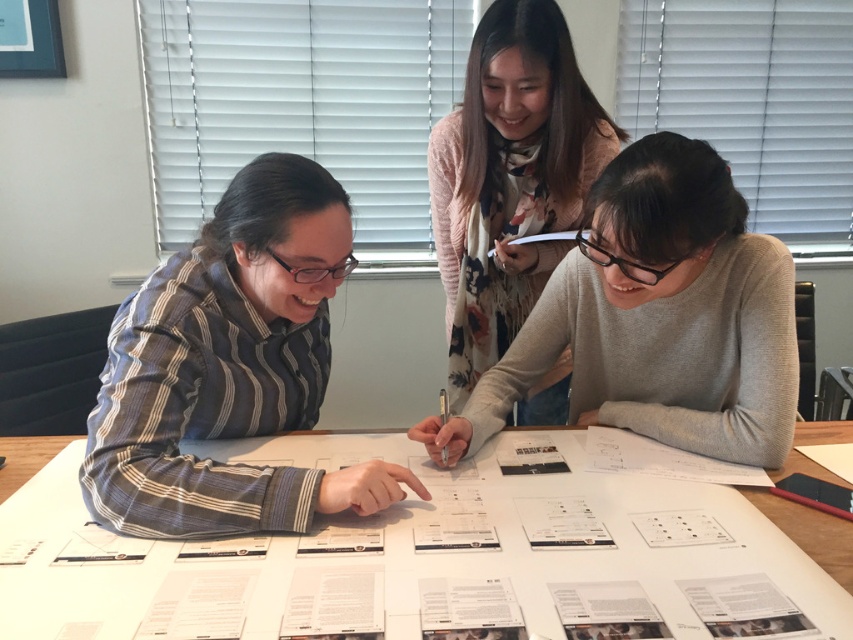
Is point (399, 609) less distant than point (303, 252)?

Yes, point (399, 609) is closer to viewer.

Is white paper at center to the left of striped cotton shirt at left from the viewer's perspective?

Incorrect, white paper at center is not on the left side of striped cotton shirt at left.

What do you see at coordinates (419, 563) in the screenshot? The height and width of the screenshot is (640, 853). I see `white paper at center` at bounding box center [419, 563].

What are the coordinates of `white paper at center` in the screenshot? It's located at (419, 563).

Does striped cotton shirt at left appear under gray matte sweater at center?

Indeed, striped cotton shirt at left is positioned under gray matte sweater at center.

Who is positioned more to the right, striped cotton shirt at left or gray matte sweater at center?

From the viewer's perspective, gray matte sweater at center appears more on the right side.

Which is in front, point (134, 346) or point (735, 456)?

Point (134, 346) is in front.

Locate an element on the screen. The height and width of the screenshot is (640, 853). striped cotton shirt at left is located at coordinates (230, 369).

Is gray matte sweater at center smaller than floral sweater at upper center?

Yes.

Between gray matte sweater at center and floral sweater at upper center, which one is positioned higher?

floral sweater at upper center is higher up.

Does point (669, 369) come behind point (560, 420)?

No, (669, 369) is in front of (560, 420).

Locate an element on the screen. gray matte sweater at center is located at coordinates (659, 317).